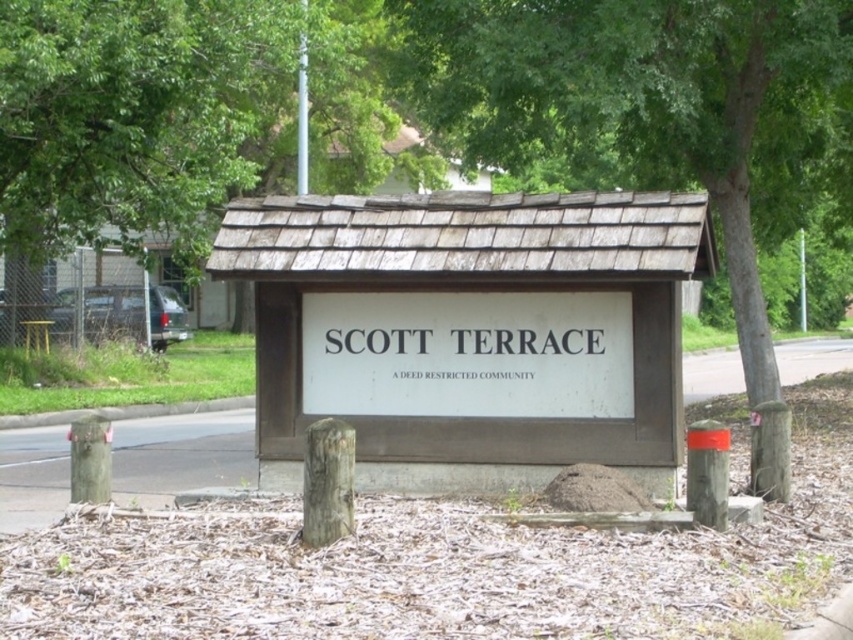
Based on the photo, can you confirm if wooden sign at center is positioned above green leafy tree at center?

Incorrect, wooden sign at center is not positioned above green leafy tree at center.

Does wooden sign at center have a lesser width compared to green leafy tree at center?

Indeed, wooden sign at center has a lesser width compared to green leafy tree at center.

Is point (624, 358) farther from camera compared to point (717, 212)?

No, it is not.

Where is `wooden sign at center`? The height and width of the screenshot is (640, 853). wooden sign at center is located at coordinates (469, 332).

Who is more distant from viewer, (488, 74) or (28, 74)?

The point (28, 74) is more distant.

Is green leafy tree at center taller than green leafy tree at upper center?

Yes, green leafy tree at center is taller than green leafy tree at upper center.

Which is behind, point (811, 164) or point (374, 168)?

Positioned behind is point (374, 168).

You are a GUI agent. You are given a task and a screenshot of the screen. Output one action in this format:
    pyautogui.click(x=<x>, y=<y>)
    Task: Click on the green leafy tree at center
    This screenshot has width=853, height=640.
    Given the screenshot: What is the action you would take?
    pyautogui.click(x=653, y=108)

Is wooden sign at center to the right of green leafy tree at upper center from the viewer's perspective?

Indeed, wooden sign at center is positioned on the right side of green leafy tree at upper center.

Who is more forward, (x=432, y=253) or (x=274, y=170)?

Point (x=432, y=253)

You are a GUI agent. You are given a task and a screenshot of the screen. Output one action in this format:
    pyautogui.click(x=<x>, y=<y>)
    Task: Click on the wooden sign at center
    
    Given the screenshot: What is the action you would take?
    pyautogui.click(x=469, y=332)